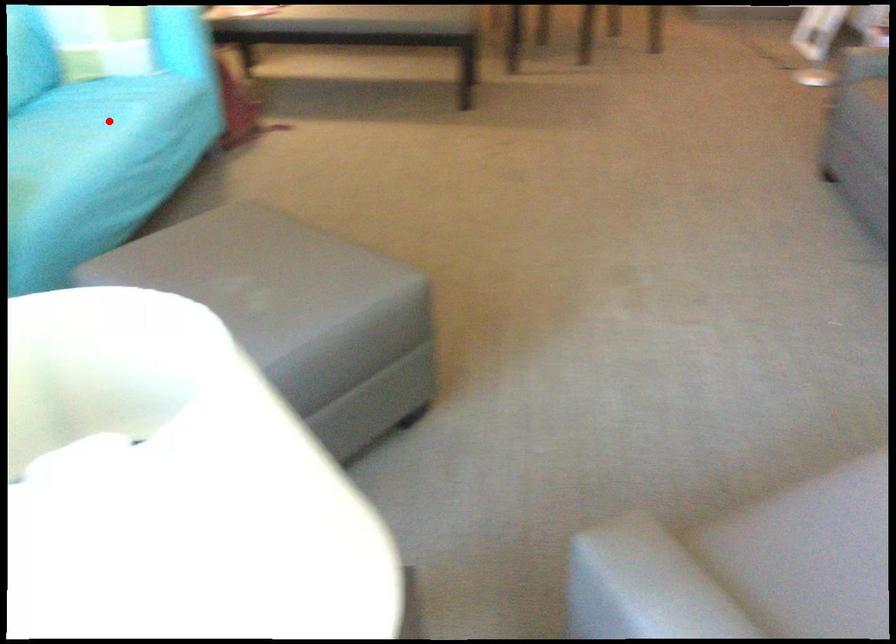
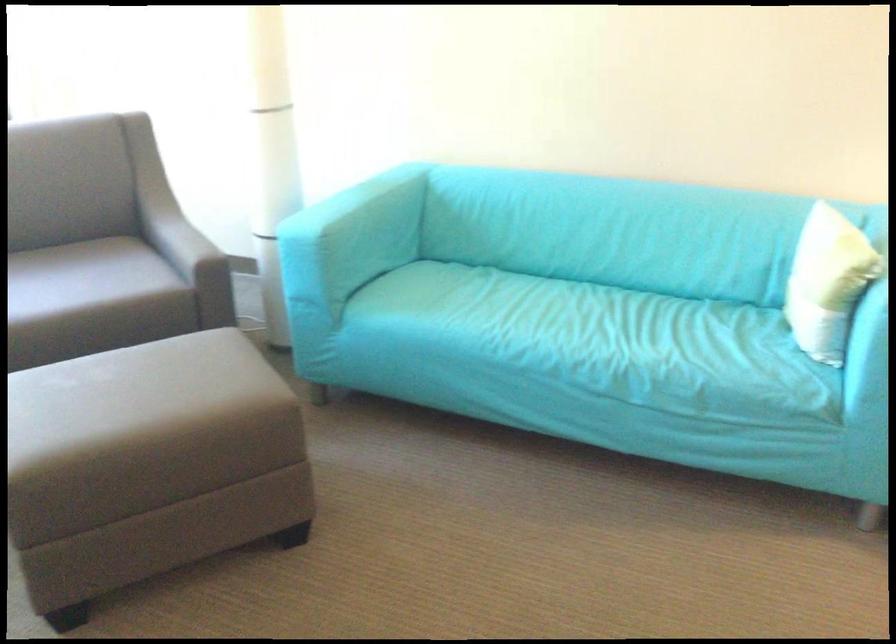
Question: I am providing you with two images of the same scene from different viewpoints. In image1, a red point is highlighted. Considering the same 3D point in image2, which of the following is correct?

Choices:
 (A) It is closer
 (B) It is farther

Answer: (A)